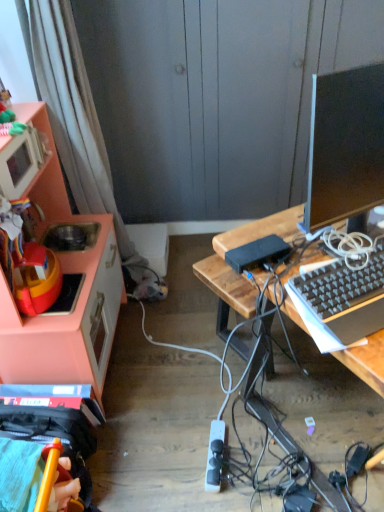
Where is `free space in front of white plastic power outlet at lower center`? The width and height of the screenshot is (384, 512). free space in front of white plastic power outlet at lower center is located at coordinates (215, 492).